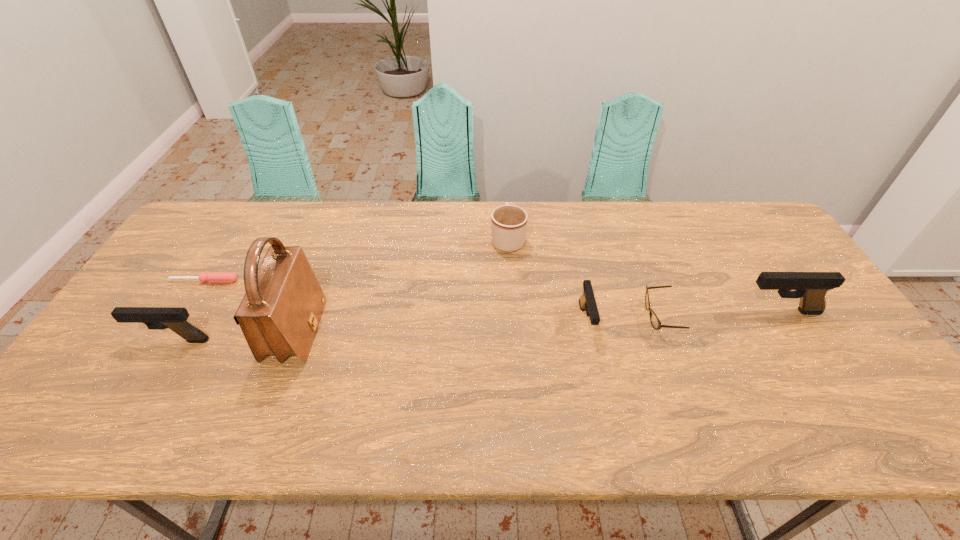
To ensure equal spacing by inserting another pistol among them, please point out a vacant spot for this new pistol. Please provide its 2D coordinates. Your answer should be formatted as a tuple, i.e. [(x, y)], where the tuple contains the x and y coordinates of a point satisfying the conditions above.

[(383, 330)]